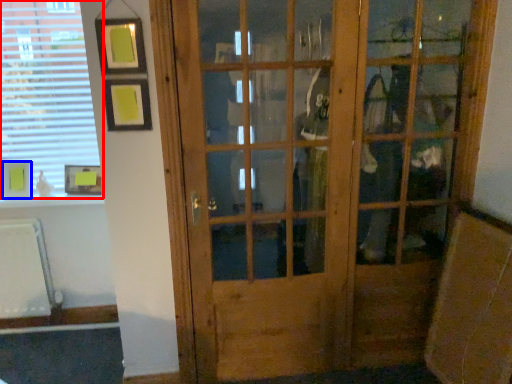
Question: Which object appears farthest to the camera in this image, window (highlighted by a red box) or picture frame (highlighted by a blue box)?

Choices:
 (A) window
 (B) picture frame

Answer: (B)